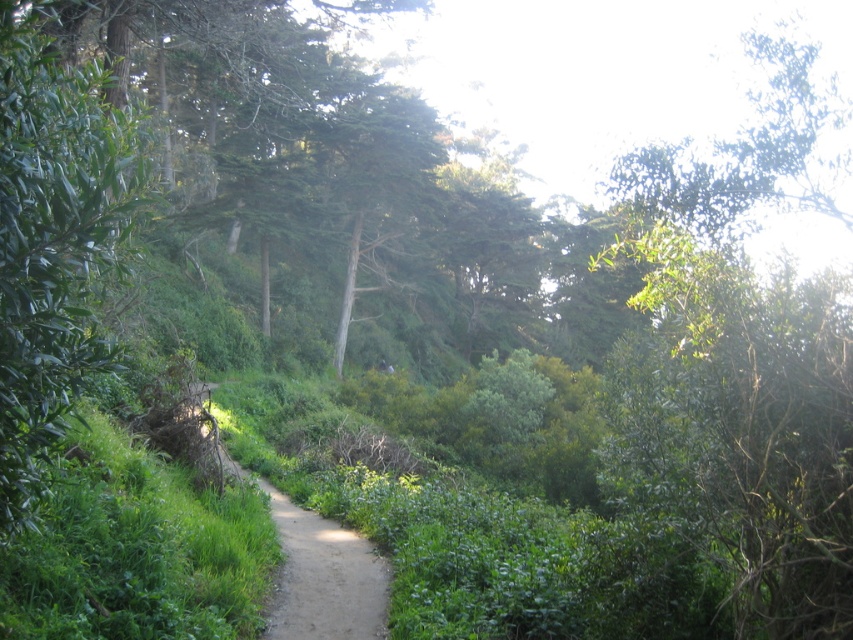
Question: Is green leafy tree at left to the right of dirt path at center from the viewer's perspective?

Choices:
 (A) yes
 (B) no

Answer: (A)

Question: From the image, what is the correct spatial relationship of green leafy tree at left in relation to dirt path at center?

Choices:
 (A) left
 (B) right

Answer: (B)

Question: Which of the following is the farthest from the observer?

Choices:
 (A) (99, 339)
 (B) (358, 568)

Answer: (B)

Question: Which point is closer to the camera?

Choices:
 (A) dirt path at center
 (B) green leafy tree at left

Answer: (B)

Question: Is green leafy tree at left thinner than dirt path at center?

Choices:
 (A) yes
 (B) no

Answer: (A)

Question: Which point appears farthest from the camera in this image?

Choices:
 (A) pyautogui.click(x=13, y=202)
 (B) pyautogui.click(x=288, y=522)

Answer: (B)